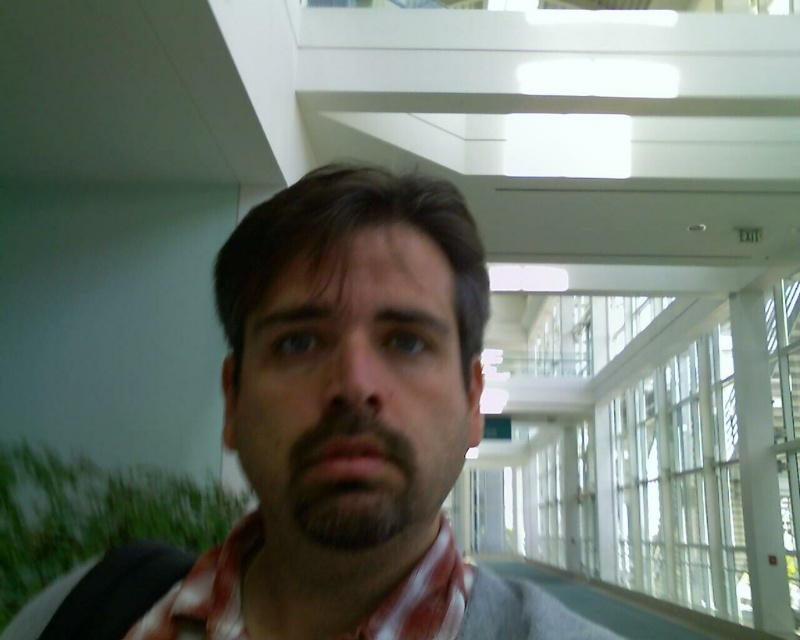
You are a photographer trying to capture a closeup of the person in the image. The red plaid scarf at center and the dark brown fuzzy beard at center are both in focus. Which object is wider when viewed from your camera lens?

The red plaid scarf at center is wider than the dark brown fuzzy beard at center, so the red plaid scarf at center will appear wider in the photo.

You are standing in the modern building and want to move from the point at coordinates point (414, 582) to the point at coordinates point (292, 508). Which direction should you move in to get closer to the latter?

You should move towards the point at coordinates point (292, 508) by moving away from the viewer since point (414, 582) is further to the viewer than point (292, 508).